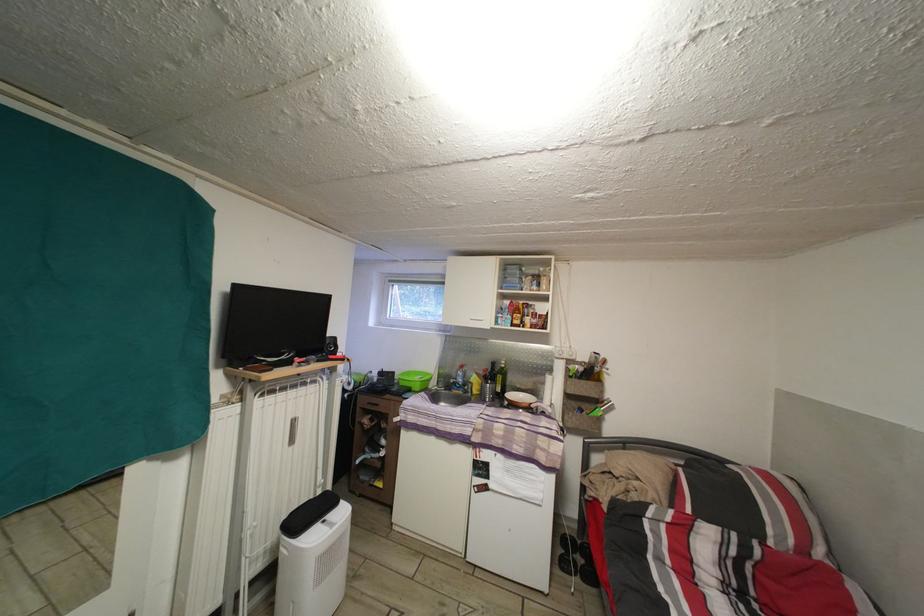
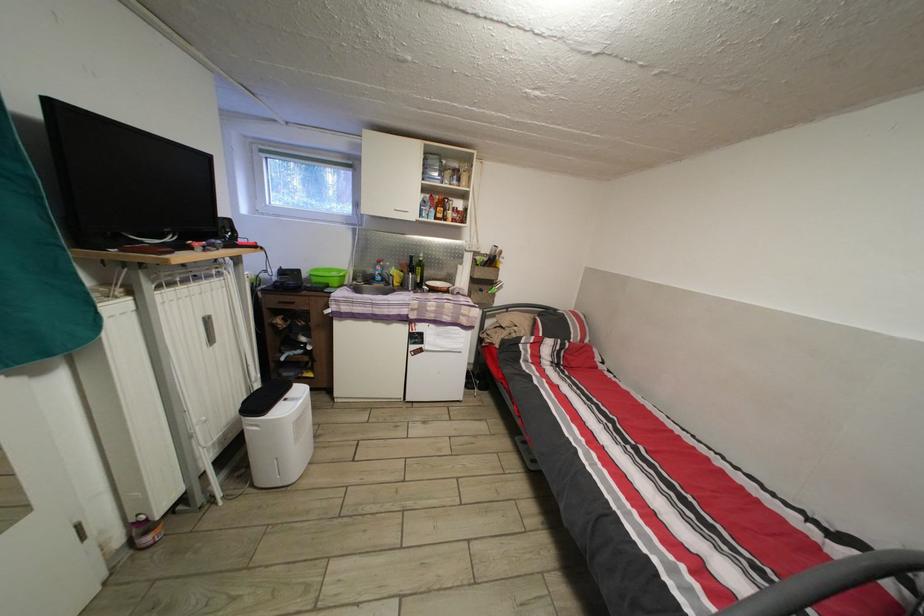
Find the pixel in the second image that matches the point at 521,322 in the first image.

(445, 215)